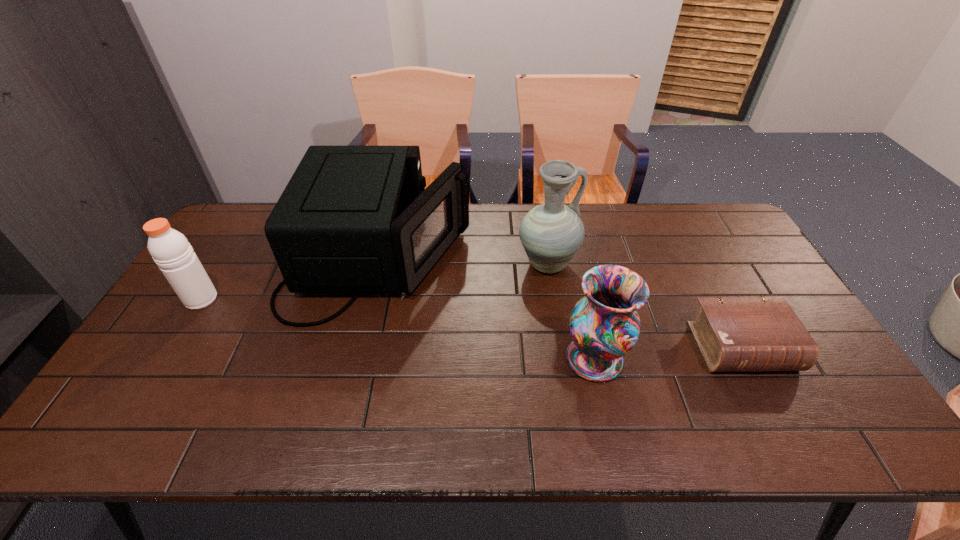
Where is `vacant area that satisfies the following two spatial constraints: 1. on the front side of the vase; 2. on the left side of the leftmost object`? This screenshot has width=960, height=540. vacant area that satisfies the following two spatial constraints: 1. on the front side of the vase; 2. on the left side of the leftmost object is located at coordinates (164, 359).

You are a GUI agent. You are given a task and a screenshot of the screen. Output one action in this format:
    pyautogui.click(x=<x>, y=<y>)
    Task: Click on the blank area in the image that satisfies the following two spatial constraints: 1. with the door open on the vase; 2. on the left side of the microwave oven
    
    Given the screenshot: What is the action you would take?
    pyautogui.click(x=355, y=359)

The width and height of the screenshot is (960, 540). Find the location of `free space that satisfies the following two spatial constraints: 1. with the door open on the second object from left to right; 2. on the front side of the leftmost object`. free space that satisfies the following two spatial constraints: 1. with the door open on the second object from left to right; 2. on the front side of the leftmost object is located at coordinates (370, 299).

What are the coordinates of `free space that satisfies the following two spatial constraints: 1. with the door open on the microwave oven; 2. on the left side of the vase` in the screenshot? It's located at 355,359.

Where is `vacant point that satisfies the following two spatial constraints: 1. on the handle side of the vase; 2. on the left side of the pitcher`? This screenshot has height=540, width=960. vacant point that satisfies the following two spatial constraints: 1. on the handle side of the vase; 2. on the left side of the pitcher is located at coordinates (563, 359).